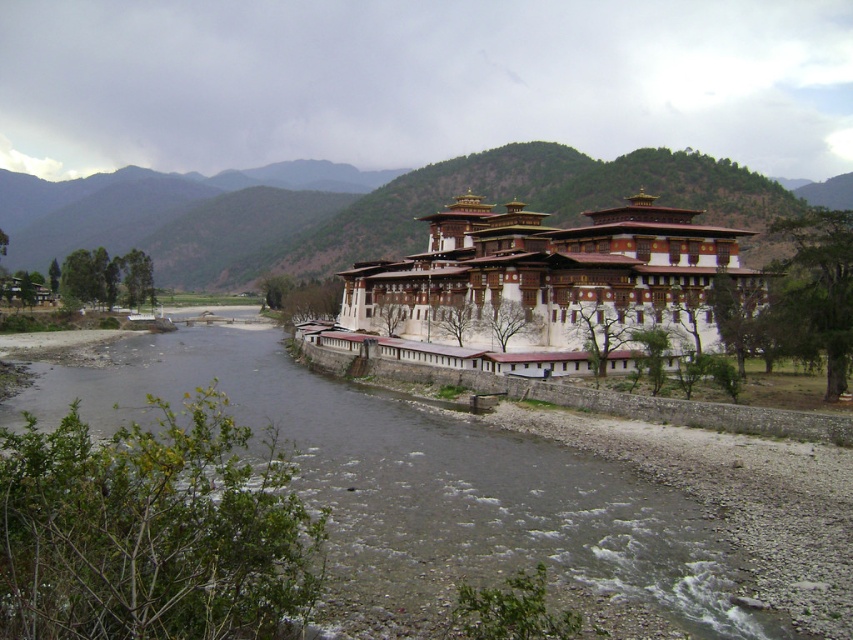
Who is more forward, (723, 205) or (666, 260)?

Point (666, 260) is more forward.

Based on the photo, measure the distance between green forested mountain at center and camera.

green forested mountain at center is 178.74 meters away from camera.

This screenshot has width=853, height=640. Describe the element at coordinates (354, 209) in the screenshot. I see `green forested mountain at center` at that location.

Where is `green forested mountain at center`? green forested mountain at center is located at coordinates (354, 209).

Is brown gravel stream at lower center wider than white painted stone building at center?

Indeed, brown gravel stream at lower center has a greater width compared to white painted stone building at center.

Who is more forward, [434,470] or [566,339]?

Point [434,470]

Is point (764, 636) positioned in front of point (469, 292)?

Yes.

The width and height of the screenshot is (853, 640). In order to click on brown gravel stream at lower center in this screenshot , I will do `click(422, 490)`.

Does brown gravel stream at lower center have a greater height compared to green forested mountain at center?

No, brown gravel stream at lower center is not taller than green forested mountain at center.

Who is positioned more to the left, brown gravel stream at lower center or green forested mountain at center?

green forested mountain at center is more to the left.

Image resolution: width=853 pixels, height=640 pixels. Identify the location of brown gravel stream at lower center. (422, 490).